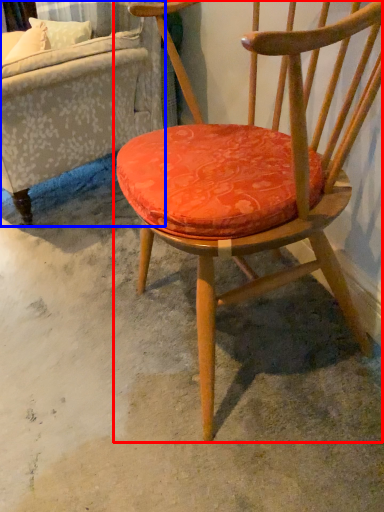
Question: Which point is closer to the camera, chair (highlighted by a red box) or studio couch (highlighted by a blue box)?

Choices:
 (A) chair
 (B) studio couch

Answer: (A)